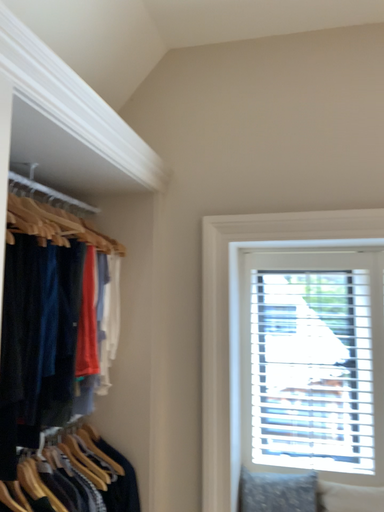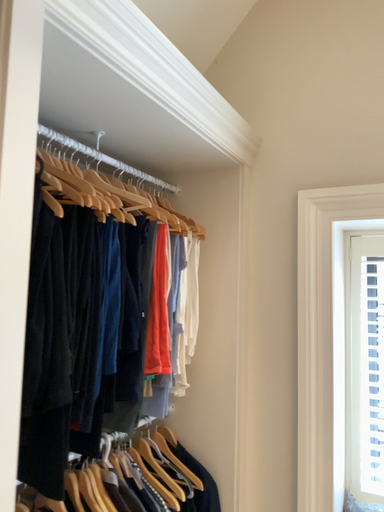
Question: Which way did the camera rotate in the video?

Choices:
 (A) rotated left
 (B) rotated right

Answer: (A)